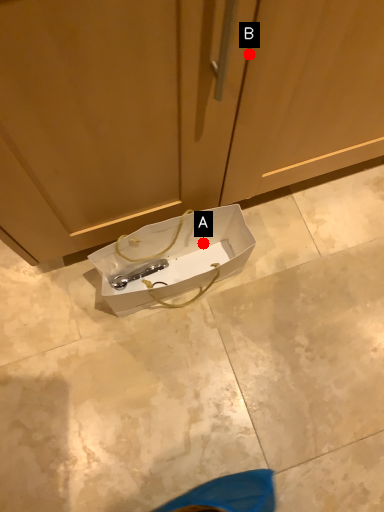
Question: Two points are circled on the image, labeled by A and B beside each circle. Which point is closer to the camera taking this photo?

Choices:
 (A) A is closer
 (B) B is closer

Answer: (B)